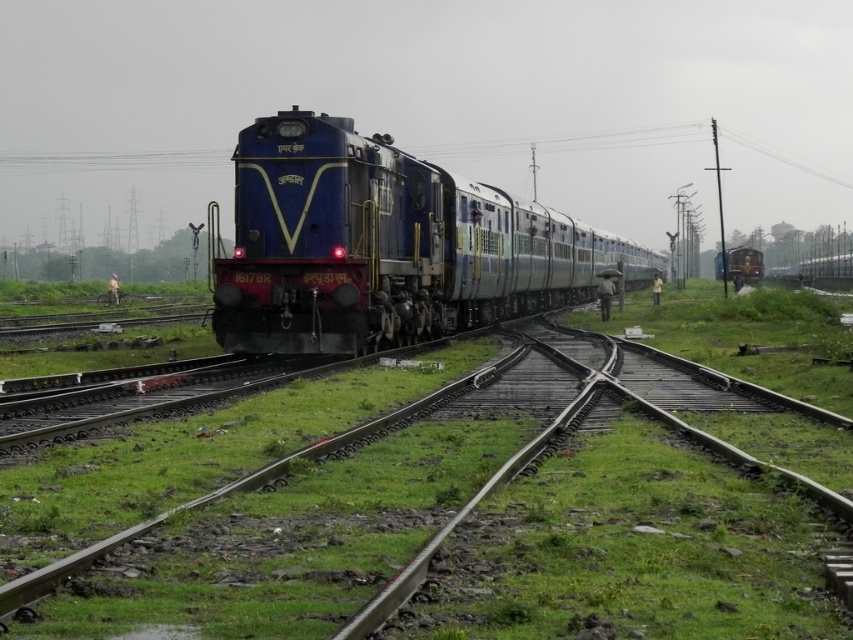
Is blue metallic train at center positioned in front of polished brass steam engine at center?

Yes, it is.

Which is in front, point (344, 138) or point (749, 273)?

Positioned in front is point (344, 138).

Locate an element on the screen. The image size is (853, 640). blue metallic train at center is located at coordinates (384, 244).

Does smooth steel track at center have a greater height compared to polished brass steam engine at center?

Incorrect, smooth steel track at center's height is not larger of polished brass steam engine at center's.

Based on the photo, is smooth steel track at center to the left of polished brass steam engine at center from the viewer's perspective?

Indeed, smooth steel track at center is positioned on the left side of polished brass steam engine at center.

What do you see at coordinates (630, 547) in the screenshot? I see `smooth steel track at center` at bounding box center [630, 547].

The image size is (853, 640). What are the coordinates of `smooth steel track at center` in the screenshot? It's located at (630, 547).

Is smooth steel track at center in front of blue metallic train at center?

Yes, smooth steel track at center is in front of blue metallic train at center.

Can you confirm if smooth steel track at center is positioned above blue metallic train at center?

No.

Is point (680, 596) positioned behind point (398, 240)?

No, (680, 596) is closer to viewer.

This screenshot has height=640, width=853. In order to click on smooth steel track at center in this screenshot , I will do `click(630, 547)`.